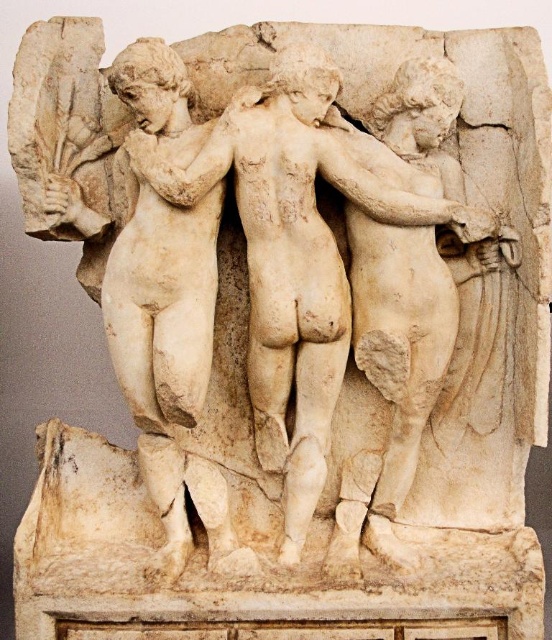
Is white marble sculpture at center closer to the viewer compared to white marble statue at center?

Yes, white marble sculpture at center is in front of white marble statue at center.

Measure the distance between white marble sculpture at center and camera.

white marble sculpture at center and camera are 4.76 feet apart.

Find the location of a particular element. The width and height of the screenshot is (552, 640). white marble sculpture at center is located at coordinates (248, 276).